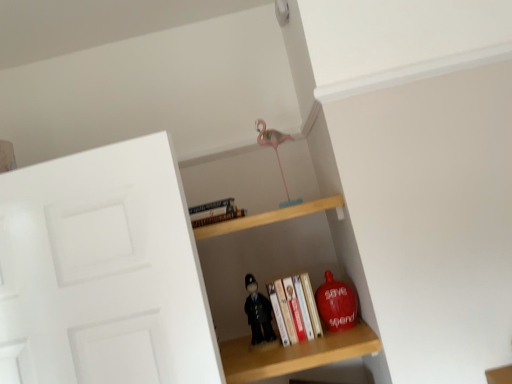
Question: Based on their sizes in the image, would you say pink plastic flamingo at upper center, placed as the 1th toy when sorted from top to bottom, is bigger or smaller than wooden shelf at upper center, which is the 1th shelf in top-to-bottom order?

Choices:
 (A) big
 (B) small

Answer: (B)

Question: From a real-world perspective, relative to wooden shelf at upper center, which is the 1th shelf in top-to-bottom order, is pink plastic flamingo at upper center, placed as the second toy when sorted from right to left, vertically above or below?

Choices:
 (A) below
 (B) above

Answer: (B)

Question: Which of these objects is positioned farthest from the black matte toy at center, which is counted as the first toy, starting from the bottom?

Choices:
 (A) hardcover book at upper center, placed as the first book when sorted from left to right
 (B) matte red piggy bank at lower right, marked as the second toy in a bottom-to-top arrangement
 (C) pink plastic flamingo at upper center, marked as the third toy in a bottom-to-top arrangement
 (D) hardcover book at center, placed as the first book when sorted from bottom to top
 (E) wooden shelf at upper center, which is the 1th shelf in top-to-bottom order

Answer: (C)

Question: Which object is positioned closest to the black matte toy at center, placed as the third toy when sorted from right to left?

Choices:
 (A) hardcover book at upper center, the 2th book when ordered from bottom to top
 (B) hardcover book at center, placed as the 2th book when sorted from left to right
 (C) matte red piggy bank at lower right, placed as the third toy when sorted from left to right
 (D) wooden shelf at upper center, placed as the 2th shelf when sorted from bottom to top
 (E) pink plastic flamingo at upper center, which is the 2th toy from left to right

Answer: (B)